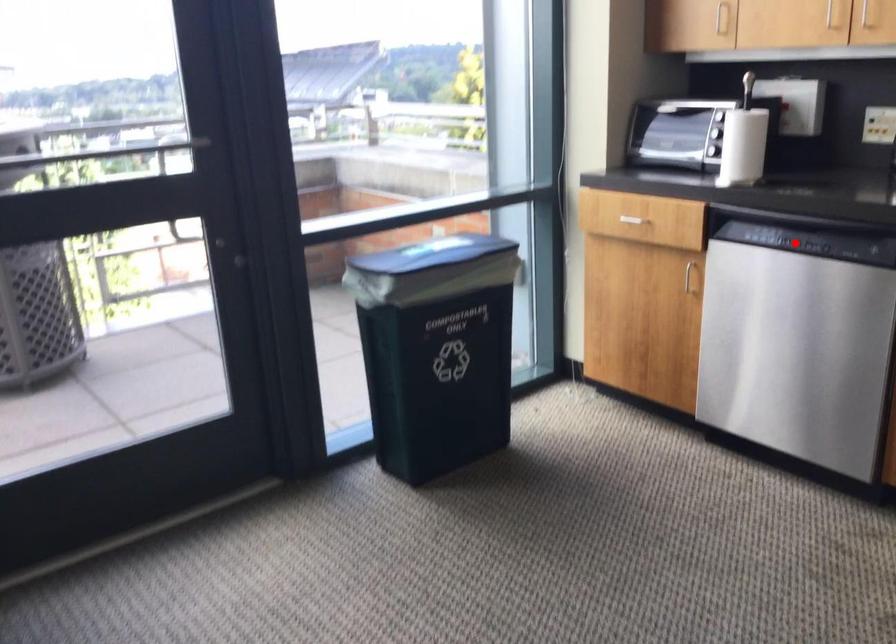
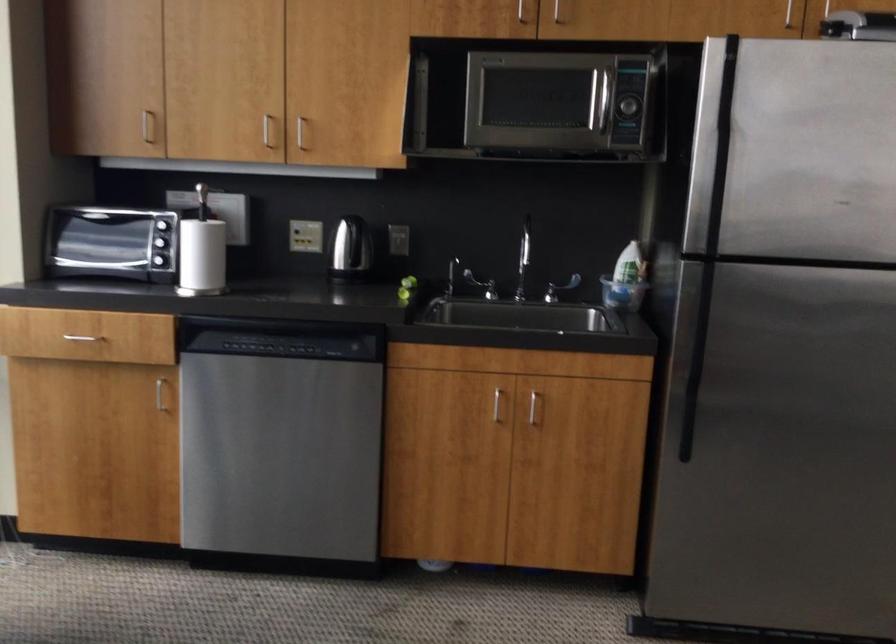
The point at the highlighted location is marked in the first image. Where is the corresponding point in the second image?

(277, 346)